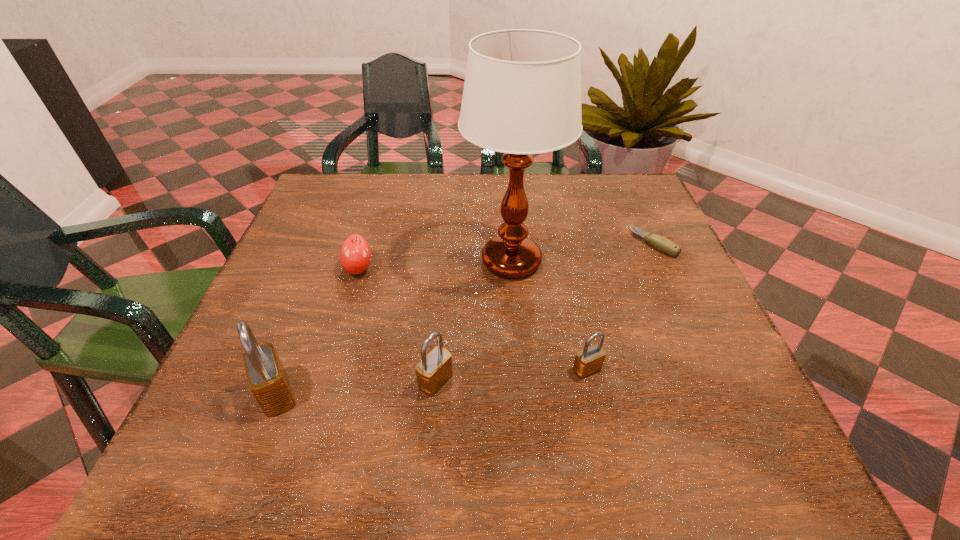
At what (x,y) coordinates should I click in order to perform the action: click on vacant space at the near edge of the desktop. Please return your answer as a coordinate pair (x, y). The width and height of the screenshot is (960, 540). Looking at the image, I should click on (509, 390).

In the image, there is a desktop. Identify the location of free space at the left edge. This screenshot has height=540, width=960. (317, 336).

What are the coordinates of `vacant space at the right edge of the desktop` in the screenshot? It's located at (649, 230).

Image resolution: width=960 pixels, height=540 pixels. In order to click on free space between the tallest object and the second tallest padlock in this screenshot , I will do `click(473, 321)`.

Locate an element on the screen. This screenshot has height=540, width=960. empty space between the rightmost padlock and the fourth object from right to left is located at coordinates (512, 375).

At what (x,y) coordinates should I click in order to perform the action: click on free space between the rightmost padlock and the rightmost object. Please return your answer as a coordinate pair (x, y). The image size is (960, 540). Looking at the image, I should click on (620, 306).

The width and height of the screenshot is (960, 540). Identify the location of unoccupied position between the fifth object from right to left and the second padlock from left to right. (397, 325).

This screenshot has width=960, height=540. Identify the location of vacant point located between the apple and the fourth shortest object. (397, 325).

Locate an element on the screen. empty space between the tallest object and the apple is located at coordinates (435, 265).

In order to click on free space between the leftmost padlock and the shortest object in this screenshot , I will do `click(466, 319)`.